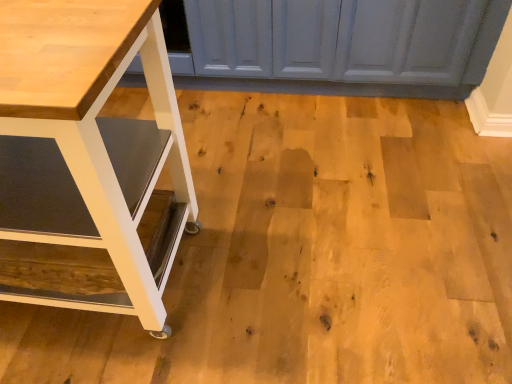
Measure the distance between point (108, 160) and camera.

The depth of point (108, 160) is 35.55 inches.

This screenshot has width=512, height=384. What do you see at coordinates (89, 159) in the screenshot?
I see `matte white table at lower left` at bounding box center [89, 159].

This screenshot has height=384, width=512. What are the coordinates of `matte white table at lower left` in the screenshot? It's located at (89, 159).

Identify the location of matte white table at lower left. (89, 159).